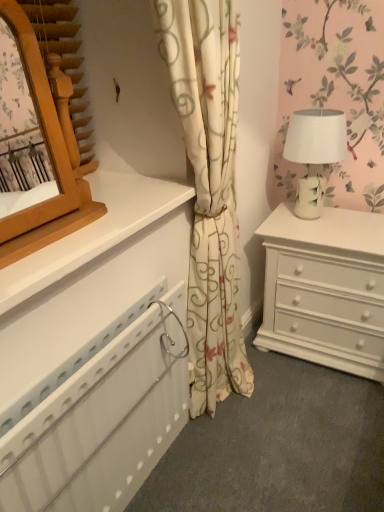
Question: Does wooden mirror at upper left turn towards white ceramic table lamp at right?

Choices:
 (A) no
 (B) yes

Answer: (A)

Question: From a real-world perspective, is wooden mirror at upper left located beneath white ceramic table lamp at right?

Choices:
 (A) no
 (B) yes

Answer: (A)

Question: From the image's perspective, is wooden mirror at upper left over white ceramic table lamp at right?

Choices:
 (A) yes
 (B) no

Answer: (B)

Question: Does wooden mirror at upper left have a lesser width compared to white ceramic table lamp at right?

Choices:
 (A) no
 (B) yes

Answer: (B)

Question: Is wooden mirror at upper left looking in the opposite direction of white ceramic table lamp at right?

Choices:
 (A) no
 (B) yes

Answer: (A)

Question: Can you see wooden mirror at upper left touching white ceramic table lamp at right?

Choices:
 (A) no
 (B) yes

Answer: (A)

Question: Is wooden mirror at upper left oriented towards white floral curtain at center?

Choices:
 (A) yes
 (B) no

Answer: (B)

Question: Is wooden mirror at upper left looking in the opposite direction of white floral curtain at center?

Choices:
 (A) yes
 (B) no

Answer: (B)

Question: From a real-world perspective, is wooden mirror at upper left on white floral curtain at center?

Choices:
 (A) yes
 (B) no

Answer: (A)

Question: Does wooden mirror at upper left appear on the right side of white floral curtain at center?

Choices:
 (A) yes
 (B) no

Answer: (B)

Question: From the image's perspective, would you say wooden mirror at upper left is shown under white floral curtain at center?

Choices:
 (A) yes
 (B) no

Answer: (B)

Question: Considering the relative positions of wooden mirror at upper left and white floral curtain at center in the image provided, is wooden mirror at upper left in front of white floral curtain at center?

Choices:
 (A) yes
 (B) no

Answer: (A)

Question: Is white ceramic table lamp at right smaller than white plastic radiator at lower left?

Choices:
 (A) yes
 (B) no

Answer: (A)